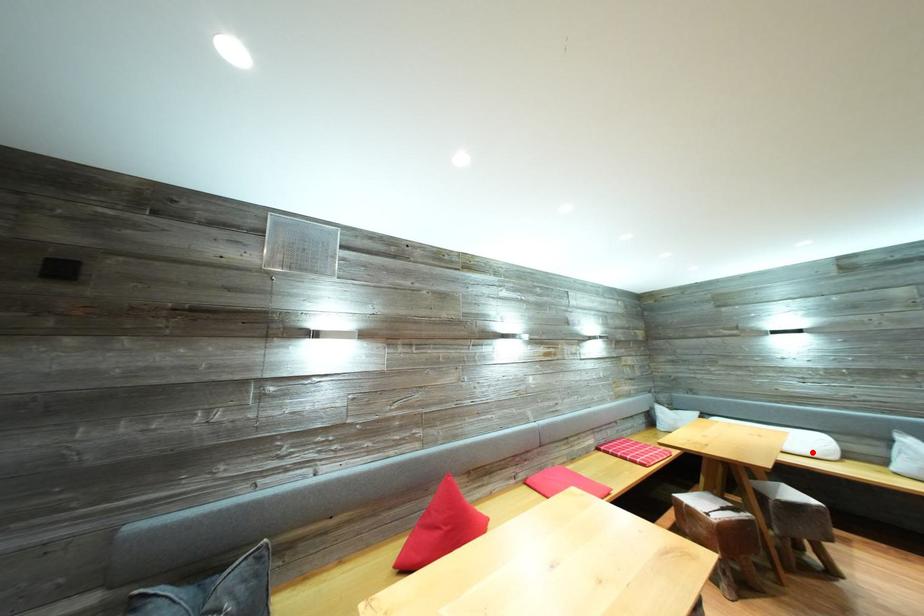
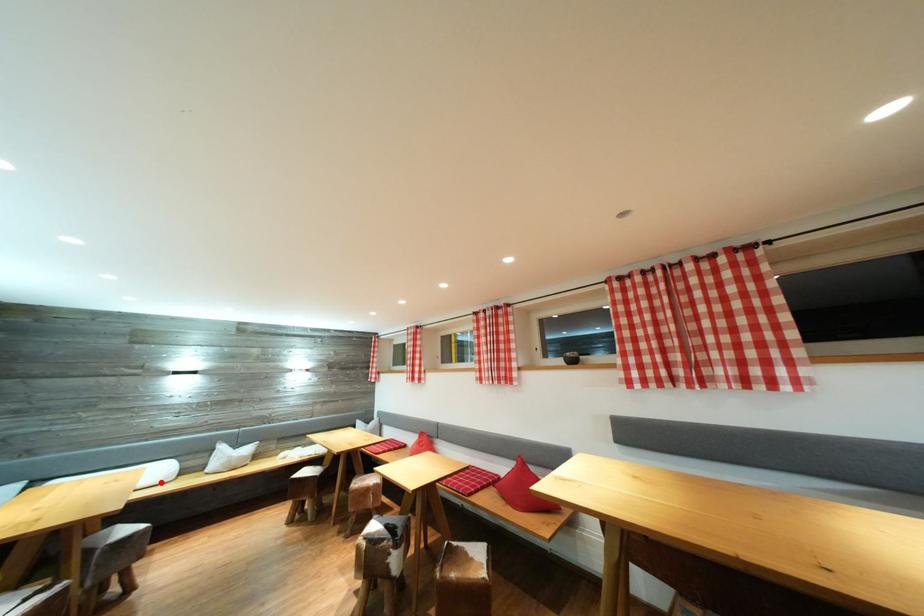
I am providing you with two images of the same scene from different viewpoints. A red point is marked on the first image and another point is marked on the second image. Is the red point in image1 aligned with the point shown in image2?

Yes